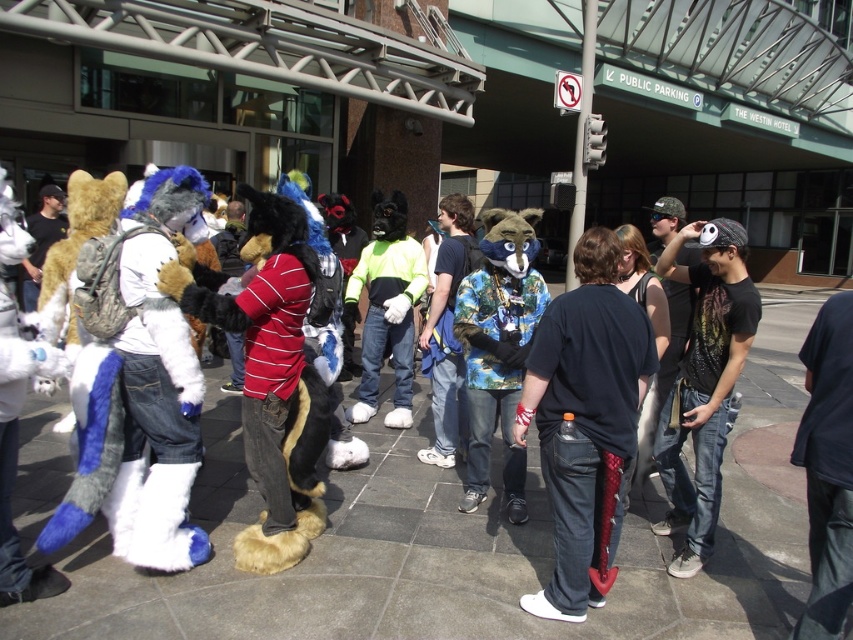
You are a photographer at the event and want to capture both the fluffy blue and white costume at center and the neon green and black costume at center in a single frame. Which costume should you position closer to the camera to ensure both are fully visible?

To ensure both the fluffy blue and white costume at center and the neon green and black costume at center are fully visible in the frame, position the fluffy blue and white costume at center closer to the camera. Since it is shorter than the neon green and black costume at center, placing it nearer will help maintain proportion and visibility for both subjects.

You are a photographer holding a camera. You want to take a photo of the dark blue hoodie at center from a distance that allows you to capture the entire hoodie in the frame without moving closer. Given that your camera has a maximum zoom range of 2 meters, can you achieve this?

The dark blue hoodie at center and camera are 2.55 meters apart. Since the camera can only zoom up to 2 meters, the photographer cannot capture the entire hoodie without moving closer.

You are standing at the entrance of the Westin Hotel and want to take a photo of the point at coordinate [839,368]. If your camera has a maximum focus range of 8 feet, will you be able to capture that point clearly?

The distance of point [839,368] from viewer is 8.57 feet. Since the camera can only focus up to 8 feet, you won